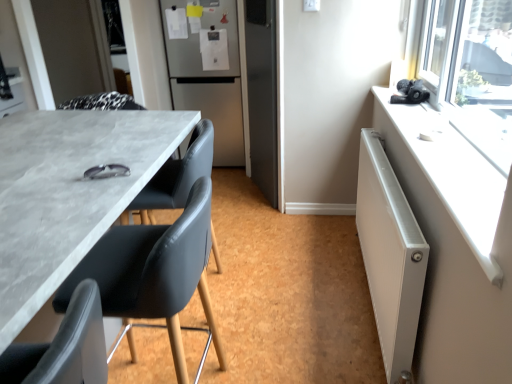
The height and width of the screenshot is (384, 512). Find the location of `empty space that is ontop of white plastic radiator at upper right (from a real-world perspective)`. empty space that is ontop of white plastic radiator at upper right (from a real-world perspective) is located at coordinates (438, 151).